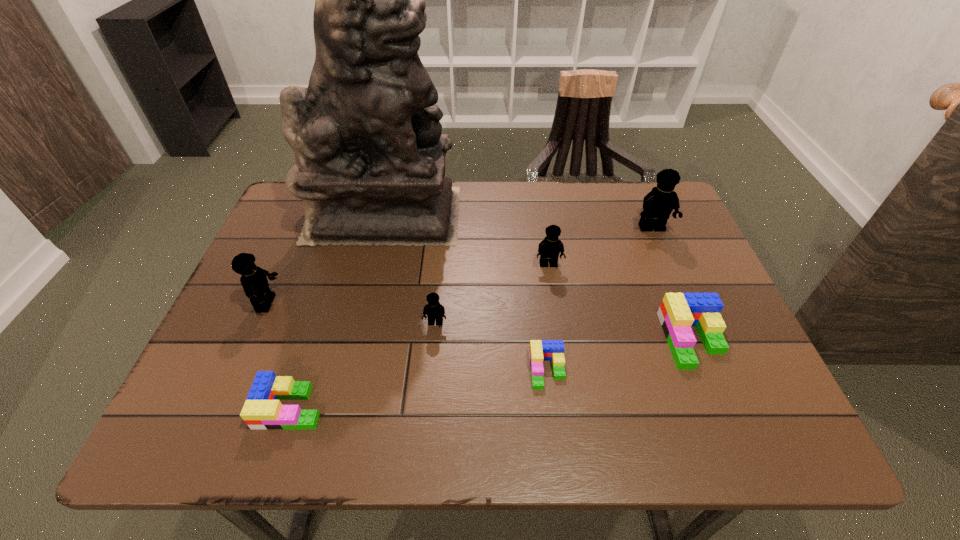
Find the location of `vacant area between the third Lego from left to right and the rightmost green Lego`. vacant area between the third Lego from left to right and the rightmost green Lego is located at coordinates (564, 331).

What are the coordinates of `vacant space that's between the second tallest object and the rightmost green Lego` in the screenshot? It's located at (672, 284).

In order to click on vacant region between the rightmost green Lego and the second shortest Lego in this screenshot , I will do `click(492, 373)`.

The image size is (960, 540). I want to click on blank region between the biggest green Lego and the sixth nearest object, so click(x=620, y=302).

Where is `free spot between the sculpture and the shortest Lego`? This screenshot has height=540, width=960. free spot between the sculpture and the shortest Lego is located at coordinates (466, 292).

Identify which object is the seventh nearest to the shortest object. Please provide its 2D coordinates. Your answer should be formatted as a tuple, i.e. [(x, y)], where the tuple contains the x and y coordinates of a point satisfying the conditions above.

[(254, 281)]

Select which object is the sixth closest to the sculpture. Please provide its 2D coordinates. Your answer should be formatted as a tuple, i.e. [(x, y)], where the tuple contains the x and y coordinates of a point satisfying the conditions above.

[(658, 204)]

Locate an element on the screen. the fifth closest Lego relative to the fifth tallest Lego is located at coordinates (x=262, y=410).

The width and height of the screenshot is (960, 540). Identify the location of Lego that is the closest one to the smallest green Lego. (435, 311).

At what (x,y) coordinates should I click in order to perform the action: click on yellow Lego that is the closest one to the fifth tallest Lego. Please return your answer as a coordinate pair (x, y). The height and width of the screenshot is (540, 960). Looking at the image, I should click on (549, 249).